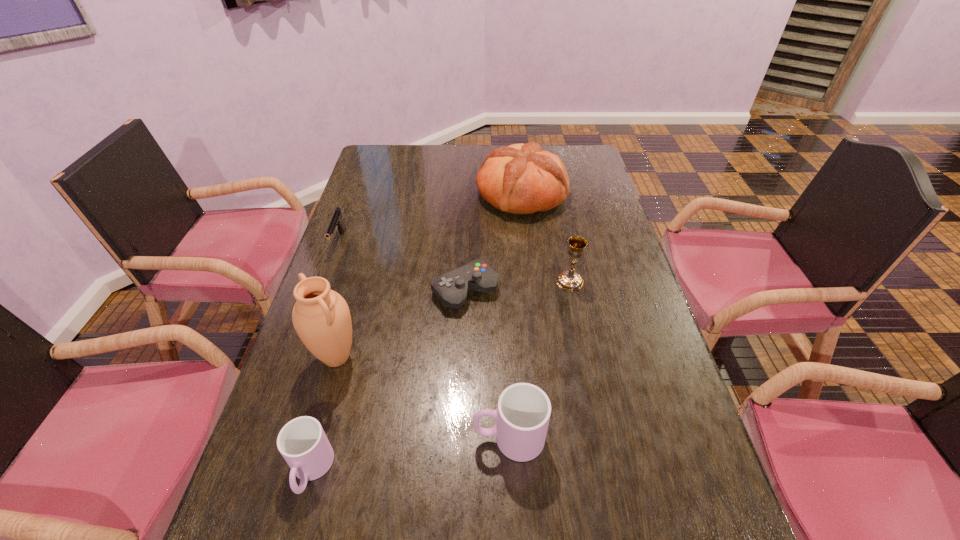
At what (x,y) coordinates should I click in order to perform the action: click on free region that satisfies the following two spatial constraints: 1. with the handle on the side of the taller cup; 2. on the right side of the bread. Please return your answer as a coordinate pair (x, y). The image size is (960, 540). Looking at the image, I should click on (496, 194).